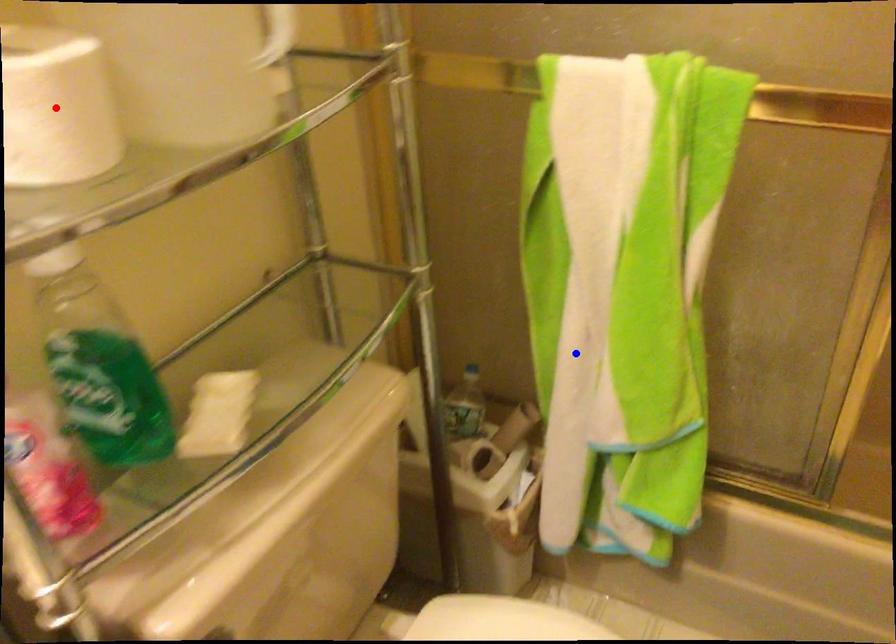
Question: Two points are marked on the image. Which point is closer to the camera?

Choices:
 (A) Blue point is closer.
 (B) Red point is closer.

Answer: (B)